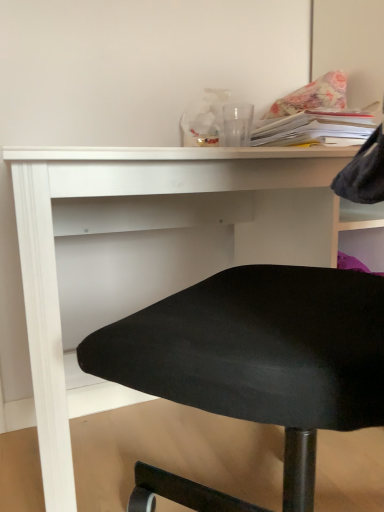
Describe the element at coordinates (315, 127) in the screenshot. The width and height of the screenshot is (384, 512). I see `white paper stack at upper right` at that location.

Measure the distance between point (69, 309) and camera.

Point (69, 309) and camera are 1.19 meters apart.

Describe the element at coordinates (156, 230) in the screenshot. I see `white matte desk at center` at that location.

Locate an element on the screen. This screenshot has width=384, height=512. white paper stack at upper right is located at coordinates (315, 127).

Is white matte desk at center far from floral fabric pillow at upper right?

white matte desk at center is near floral fabric pillow at upper right, not far away.

Looking at their sizes, would you say white matte desk at center is wider or thinner than floral fabric pillow at upper right?

white matte desk at center is wider than floral fabric pillow at upper right.

Can you confirm if white matte desk at center is taller than floral fabric pillow at upper right?

Indeed, white matte desk at center has a greater height compared to floral fabric pillow at upper right.

Considering the sizes of floral fabric pillow at upper right and white matte desk at center in the image, is floral fabric pillow at upper right taller or shorter than white matte desk at center?

Considering their sizes, floral fabric pillow at upper right has less height than white matte desk at center.

Which is in front, point (337, 79) or point (326, 219)?

The point (326, 219) is more forward.

From a real-world perspective, between floral fabric pillow at upper right and white matte desk at center, who is vertically lower?

white matte desk at center is physically lower.

Considering the points (321, 113) and (305, 85), which point is in front, point (321, 113) or point (305, 85)?

The point (321, 113) is closer.

Is white paper stack at upper right bigger or smaller than floral fabric pillow at upper right?

Clearly, white paper stack at upper right is smaller in size than floral fabric pillow at upper right.

Is white paper stack at upper right spatially inside floral fabric pillow at upper right, or outside of it?

white paper stack at upper right lies outside floral fabric pillow at upper right.

Considering the relative sizes of white paper stack at upper right and floral fabric pillow at upper right in the image provided, is white paper stack at upper right thinner than floral fabric pillow at upper right?

In fact, white paper stack at upper right might be wider than floral fabric pillow at upper right.

Can you confirm if white paper stack at upper right is smaller than white matte desk at center?

Indeed, white paper stack at upper right has a smaller size compared to white matte desk at center.

Looking at this image, is white paper stack at upper right to the left or to the right of white matte desk at center in the image?

Based on their positions, white paper stack at upper right is located to the right of white matte desk at center.

Is white paper stack at upper right taller than white matte desk at center?

No.

How different are the orientations of white paper stack at upper right and white matte desk at center in degrees?

There is a 3.25-degree angle between the facing directions of white paper stack at upper right and white matte desk at center.

Considering the points (329, 90) and (346, 137), which point is in front, point (329, 90) or point (346, 137)?

Point (346, 137)

The image size is (384, 512). In order to click on pillow located above the white paper stack at upper right (from a real-world perspective) in this screenshot , I will do `click(312, 96)`.

Who is bigger, floral fabric pillow at upper right or white paper stack at upper right?

floral fabric pillow at upper right is bigger.

Between floral fabric pillow at upper right and white paper stack at upper right, which one is positioned behind?

floral fabric pillow at upper right is behind.

Does point (62, 397) come farther from viewer compared to point (350, 131)?

No, it is not.

Is white matte desk at center facing towards white paper stack at upper right?

No, white matte desk at center does not turn towards white paper stack at upper right.

Is white matte desk at center outside of white paper stack at upper right?

white matte desk at center lies outside white paper stack at upper right's area.

Locate an element on the screen. The height and width of the screenshot is (512, 384). pillow above the white matte desk at center (from the image's perspective) is located at coordinates (312, 96).

This screenshot has width=384, height=512. Find the location of `pillow on the right of white matte desk at center`. pillow on the right of white matte desk at center is located at coordinates (312, 96).

Considering their positions, is white matte desk at center positioned closer to white paper stack at upper right than floral fabric pillow at upper right?

Based on the image, floral fabric pillow at upper right appears to be nearer to white paper stack at upper right.

Based on their spatial positions, is white paper stack at upper right or white matte desk at center closer to floral fabric pillow at upper right?

Among the two, white paper stack at upper right is located nearer to floral fabric pillow at upper right.

Based on their spatial positions, is floral fabric pillow at upper right or white matte desk at center further from white paper stack at upper right?

Based on the image, white matte desk at center appears to be further to white paper stack at upper right.

Looking at the image, which one is located closer to floral fabric pillow at upper right, white matte desk at center or white paper stack at upper right?

Among the two, white paper stack at upper right is located nearer to floral fabric pillow at upper right.

From the image, which object appears to be nearer to white matte desk at center, floral fabric pillow at upper right or white paper stack at upper right?

white paper stack at upper right is closer to white matte desk at center.

Considering their positions, is white paper stack at upper right positioned further to white matte desk at center than floral fabric pillow at upper right?

Based on the image, floral fabric pillow at upper right appears to be further to white matte desk at center.

I want to click on book between floral fabric pillow at upper right and white matte desk at center in the vertical direction, so click(x=315, y=127).